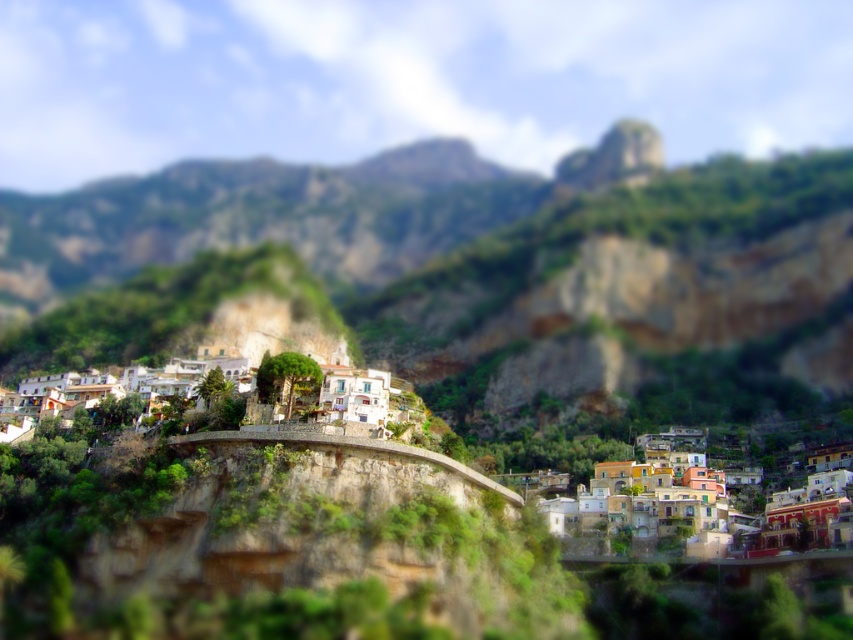
Question: Is multicolored stone houses at lower right thinner than white stucco houses at center?

Choices:
 (A) yes
 (B) no

Answer: (A)

Question: Which of the following is the closest to the observer?

Choices:
 (A) green rocky mountain at center
 (B) white stucco houses at center
 (C) multicolored stone houses at lower right

Answer: (B)

Question: Which object is closer to the camera taking this photo?

Choices:
 (A) green rocky mountain at center
 (B) multicolored stone houses at lower right

Answer: (B)

Question: Where is multicolored stone houses at lower right located in relation to white stucco houses at center in the image?

Choices:
 (A) below
 (B) above

Answer: (A)

Question: Where is green rocky mountain at center located in relation to white stucco houses at center in the image?

Choices:
 (A) above
 (B) below

Answer: (A)

Question: Which object appears closest to the camera in this image?

Choices:
 (A) green rocky mountain at center
 (B) multicolored stone houses at lower right
 (C) white stucco houses at center

Answer: (C)